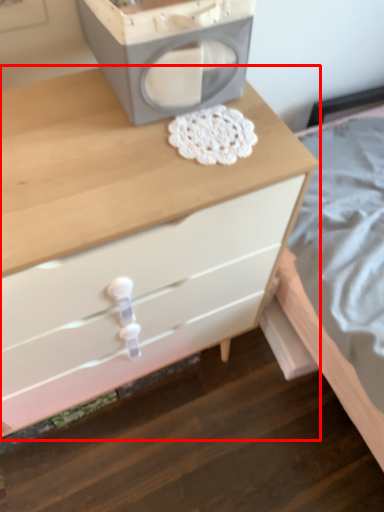
Question: In this image, where is chest of drawers (annotated by the red box) located relative to appliance?

Choices:
 (A) right
 (B) left

Answer: (B)